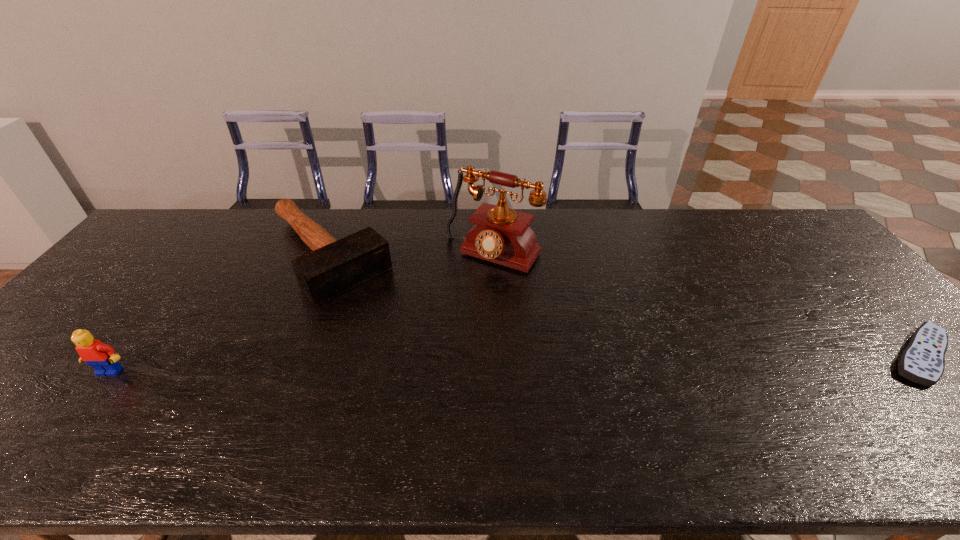
The height and width of the screenshot is (540, 960). Find the location of `vacant space located 0.300m on the hammer head face of the third tallest object`. vacant space located 0.300m on the hammer head face of the third tallest object is located at coordinates (424, 355).

Where is `vacant space situated on the hammer head face of the third tallest object`? vacant space situated on the hammer head face of the third tallest object is located at coordinates (394, 323).

Locate an element on the screen. This screenshot has height=540, width=960. vacant space located 0.100m on the hammer head face of the third tallest object is located at coordinates (381, 312).

The height and width of the screenshot is (540, 960). Identify the location of telephone at the far edge. (501, 235).

What are the coordinates of `mallet that is at the far edge` in the screenshot? It's located at (334, 267).

This screenshot has height=540, width=960. I want to click on vacant space at the far edge, so click(567, 213).

At what (x,y) coordinates should I click in order to perform the action: click on vacant space at the near edge of the desktop. Please return your answer as a coordinate pair (x, y). The image size is (960, 540). Looking at the image, I should click on (256, 388).

I want to click on free region at the left edge of the desktop, so click(x=132, y=284).

Locate an element on the screen. The height and width of the screenshot is (540, 960). vacant region at the right edge of the desktop is located at coordinates (877, 354).

Identify the location of vacant space at the far left corner of the desktop. (204, 210).